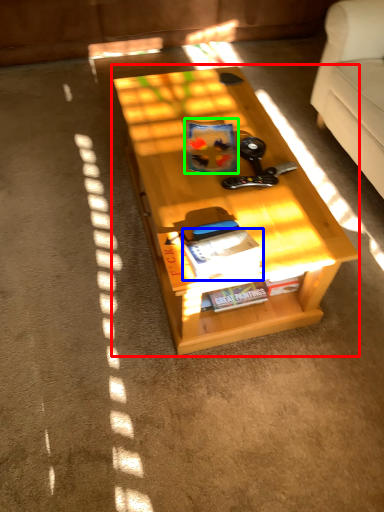
Question: Which object is the closest to the table (highlighted by a red box)? Choose among these: magazine (highlighted by a blue box) or book (highlighted by a green box).

Choices:
 (A) magazine
 (B) book

Answer: (B)